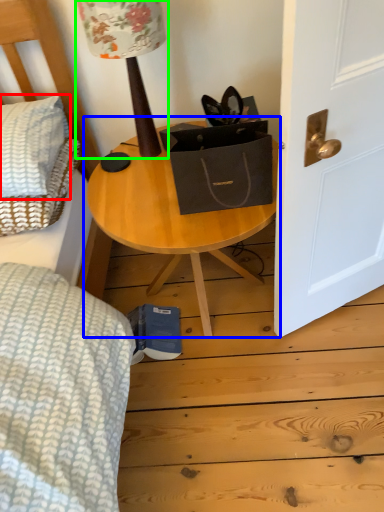
Question: Which object is the closest to the pillow (highlighted by a red box)? Choose among these: table (highlighted by a blue box) or table lamp (highlighted by a green box).

Choices:
 (A) table
 (B) table lamp

Answer: (A)